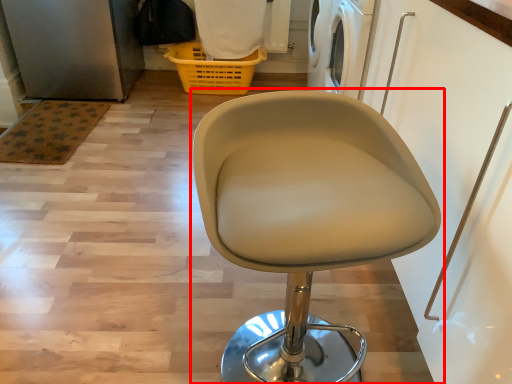
Question: From the image's perspective, what is the correct spatial positioning of chair (annotated by the red box) in reference to basket?

Choices:
 (A) below
 (B) above

Answer: (A)